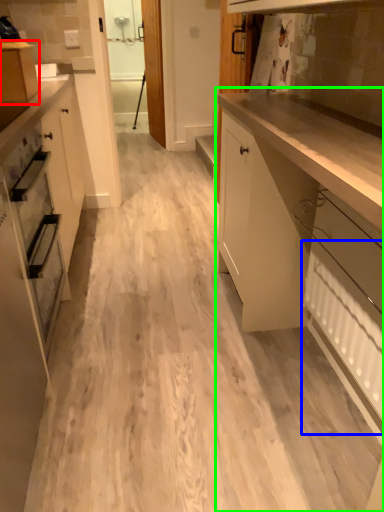
Question: Considering the real-world distances, which object is farthest from cabinetry (highlighted by a red box)? radiator (highlighted by a blue box) or cabinetry (highlighted by a green box)?

Choices:
 (A) radiator
 (B) cabinetry

Answer: (A)